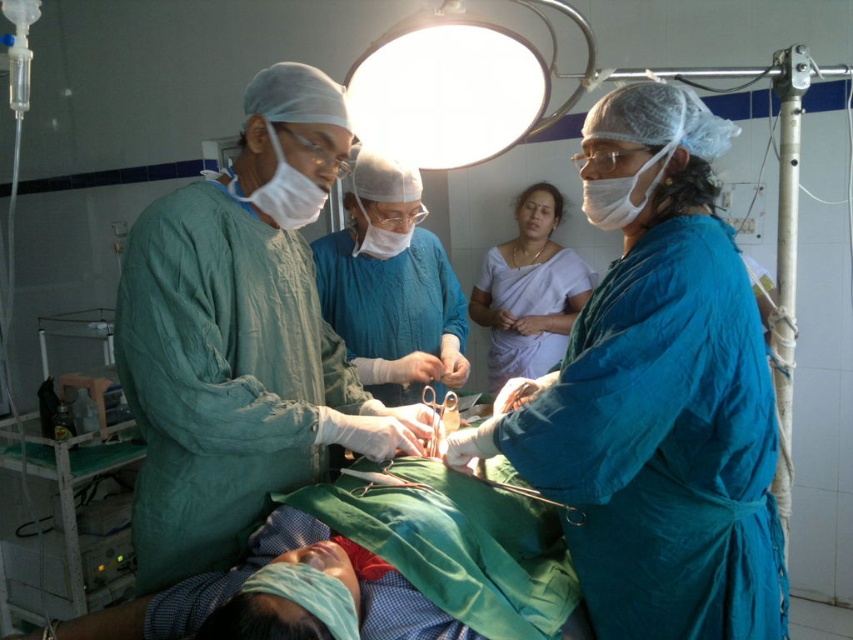
Based on the photo, is blue scrubs at center taller than white silk saree at center?

Correct, blue scrubs at center is much taller as white silk saree at center.

Is blue scrubs at center wider than white silk saree at center?

Indeed, blue scrubs at center has a greater width compared to white silk saree at center.

In order to click on blue scrubs at center in this screenshot , I will do pyautogui.click(x=657, y=394).

Where is `blue scrubs at center`? Image resolution: width=853 pixels, height=640 pixels. blue scrubs at center is located at coordinates (657, 394).

Does point (164, 534) come behind point (561, 280)?

No.

Between point (131, 380) and point (543, 234), which one is positioned in front?

Positioned in front is point (131, 380).

This screenshot has width=853, height=640. I want to click on green scrubs at center, so click(x=241, y=339).

Between green scrubs at center and surgical scissors at center, which one is positioned lower?

surgical scissors at center is below.

Locate an element on the screen. green scrubs at center is located at coordinates (241, 339).

Locate an element on the screen. green scrubs at center is located at coordinates (241, 339).